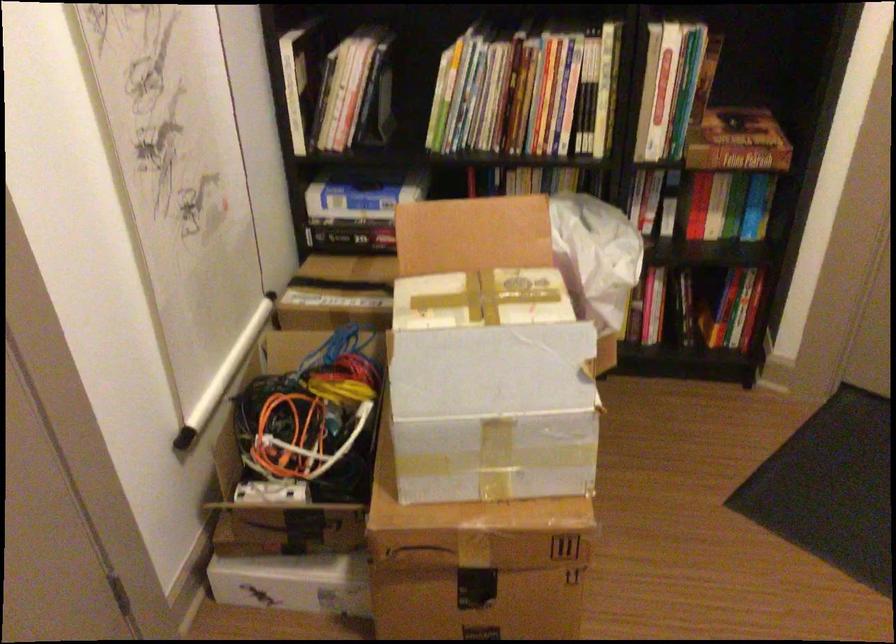
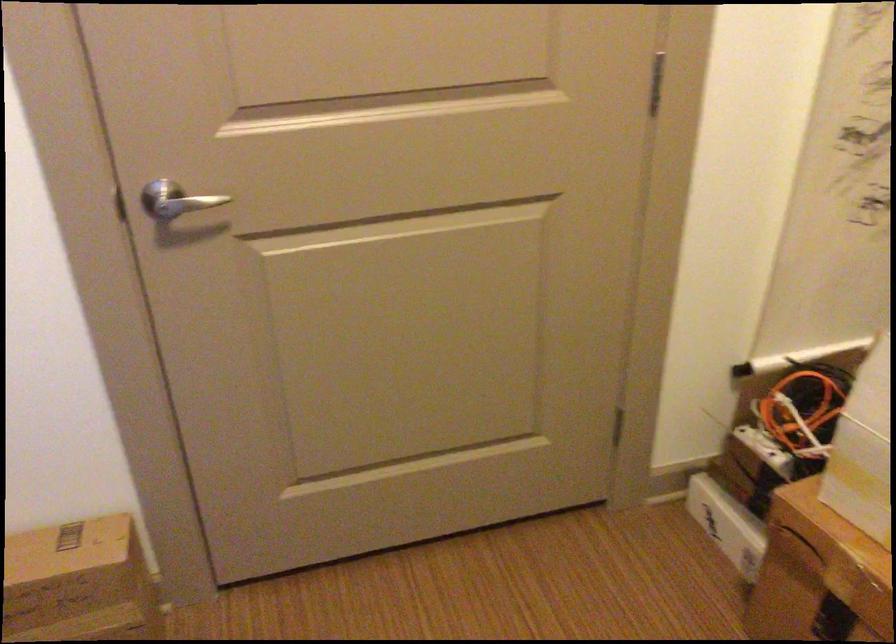
The point at (280, 440) is marked in the first image. Where is the corresponding point in the second image?

(803, 408)